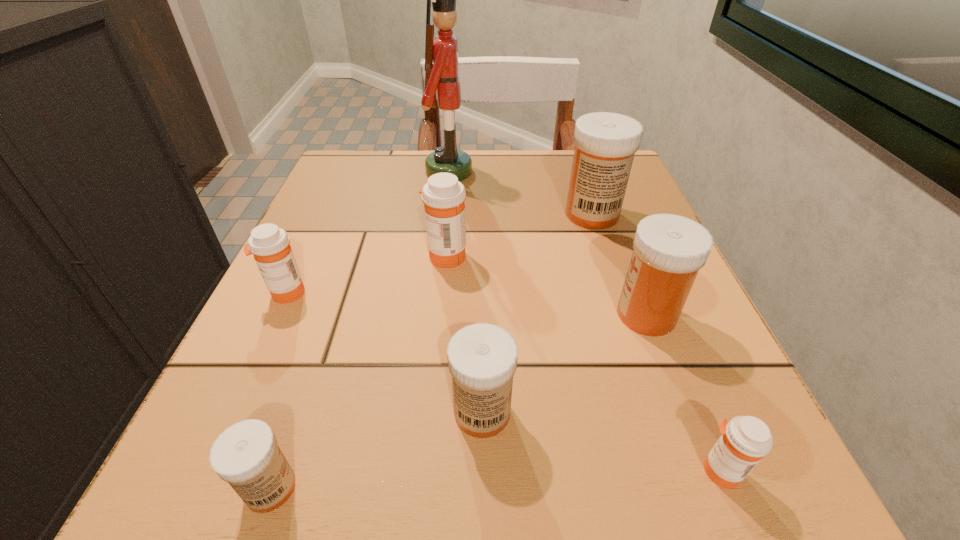
Where is `the third white medicine from right to left`? the third white medicine from right to left is located at coordinates (482, 358).

Locate an element on the screen. The width and height of the screenshot is (960, 540). the smallest orange medicine is located at coordinates (745, 440).

Locate an element on the screen. The height and width of the screenshot is (540, 960). the nearest orange medicine is located at coordinates click(745, 440).

You are a GUI agent. You are given a task and a screenshot of the screen. Output one action in this format:
    pyautogui.click(x=<x>, y=<y>)
    Task: Click on the seventh object from right to left
    
    Given the screenshot: What is the action you would take?
    pos(246,455)

Image resolution: width=960 pixels, height=540 pixels. What are the coordinates of `the second medicine from left to right` in the screenshot? It's located at (246, 455).

The height and width of the screenshot is (540, 960). Identify the location of blank space located on the front-facing side of the green nutcracker. (531, 172).

Identify the location of vacant space located 0.050m on the right of the farthest white medicine. The height and width of the screenshot is (540, 960). (646, 214).

Locate an element on the screen. The width and height of the screenshot is (960, 540). free space located on the back of the sixth nearest object is located at coordinates (450, 206).

Find the location of `free region located 0.150m on the back of the second farthest white medicine`. free region located 0.150m on the back of the second farthest white medicine is located at coordinates (616, 236).

Find the location of a particular element. vacant space situated 0.140m on the front of the leftmost medicine is located at coordinates (244, 382).